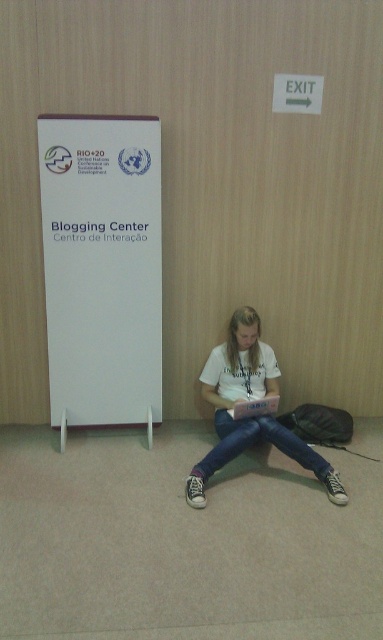
You are organizing a workshop in the Blogging Center and need to display two items on a wall. You have a white paper at left and a white cotton shirt at center. Which item should you choose if you want to hang something taller?

The white paper at left is much taller than the white cotton shirt at center, so you should choose the white paper at left for hanging if you want something taller.

You are standing at the point labeled point (76, 221). You want to move to the banner labeled

The distance between the point labeled point (76, 221) and the banner labeled